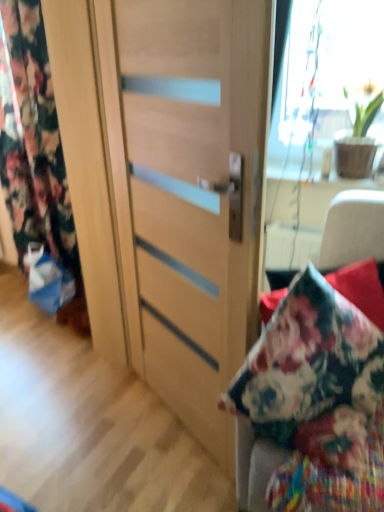
Question: Visually, is floral fabric curtain at left positioned to the left or to the right of matte wood door at center?

Choices:
 (A) right
 (B) left

Answer: (B)

Question: Which is correct: floral fabric curtain at left is inside matte wood door at center, or outside of it?

Choices:
 (A) outside
 (B) inside

Answer: (A)

Question: Which object is positioned closest to the floral fabric curtain at left?

Choices:
 (A) matte wood door at center
 (B) green matte plant at upper right
 (C) wooden cabinet at center

Answer: (A)

Question: Which object is positioned closest to the matte wood door at center?

Choices:
 (A) green matte plant at upper right
 (B) floral fabric curtain at left
 (C) wooden cabinet at center

Answer: (C)